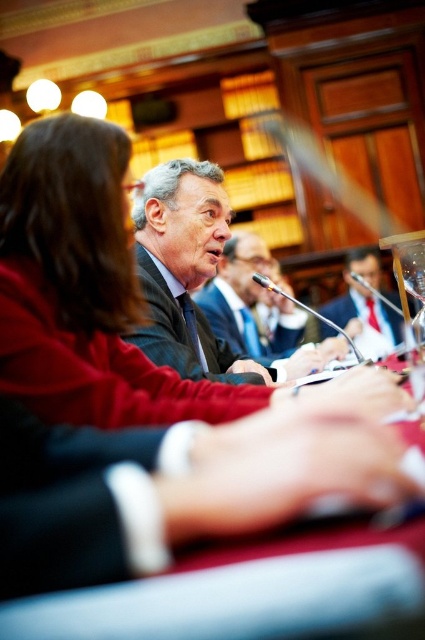
Who is more forward, [303,362] or [371,292]?

Point [303,362] is more forward.

Identify the location of dark suit at center. (258, 312).

Is smooth red table at center closer to the viewer compared to dark suit at center?

Yes, it is.

Which of these two, smooth red table at center or dark suit at center, stands shorter?

smooth red table at center

Which is behind, point (223, 614) or point (297, 342)?

Point (297, 342)

At what (x,y) coordinates should I click in order to perform the action: click on smooth red table at center. Please return your answer as a coordinate pair (x, y). Image resolution: width=425 pixels, height=640 pixels. Looking at the image, I should click on (180, 561).

Where is `smooth red table at center`? smooth red table at center is located at coordinates (180, 561).

Which is behind, point (102, 566) or point (155, 228)?

Point (155, 228)

Which is in front, point (221, 611) or point (200, 198)?

Point (221, 611)

Where is `smooth red table at center`? smooth red table at center is located at coordinates click(180, 561).